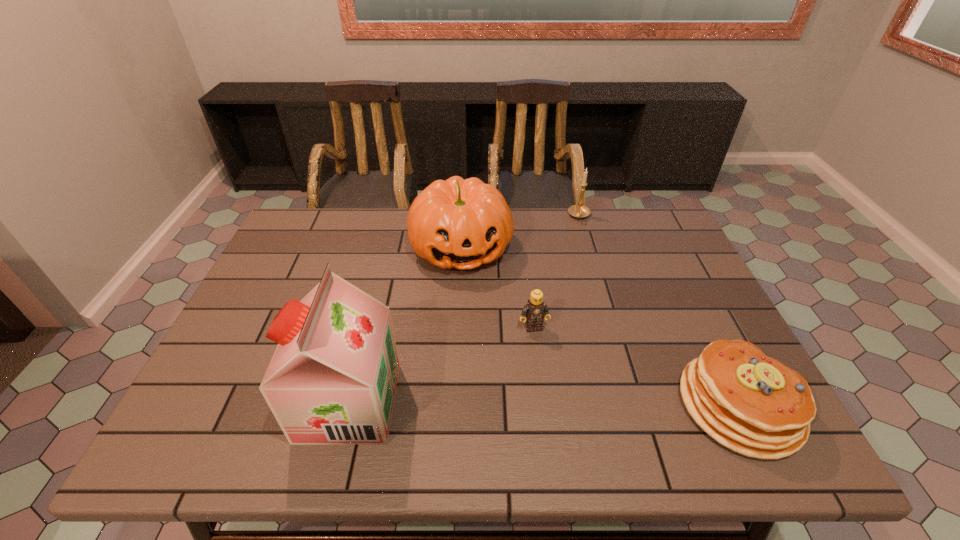
Where is `the tallest object`? the tallest object is located at coordinates (332, 380).

The image size is (960, 540). In order to click on pancake in this screenshot , I will do `click(753, 404)`.

Locate an element on the screen. Image resolution: width=960 pixels, height=540 pixels. pumpkin is located at coordinates (456, 223).

Identify the location of Lego. This screenshot has width=960, height=540. (535, 310).

At what (x,y) coordinates should I click in order to perform the action: click on the fourth object from left to right. Please return your answer as a coordinate pair (x, y). Image resolution: width=960 pixels, height=540 pixels. Looking at the image, I should click on (579, 211).

The image size is (960, 540). What are the coordinates of `candle holder` in the screenshot? It's located at (579, 211).

Identify the location of vacant space situated with the cap open on the soya milk. (263, 402).

The height and width of the screenshot is (540, 960). I want to click on vacant space located with the cap open on the soya milk, so click(x=194, y=402).

Locate an element on the screen. free space located 0.130m with the cap open on the soya milk is located at coordinates (245, 402).

You are a GUI agent. You are given a task and a screenshot of the screen. Output one action in this format:
    pyautogui.click(x=<x>, y=<y>)
    Task: Click on the vacant space located 0.080m on the back of the pancake
    Image resolution: width=960 pixels, height=540 pixels.
    Given the screenshot: What is the action you would take?
    pyautogui.click(x=704, y=333)